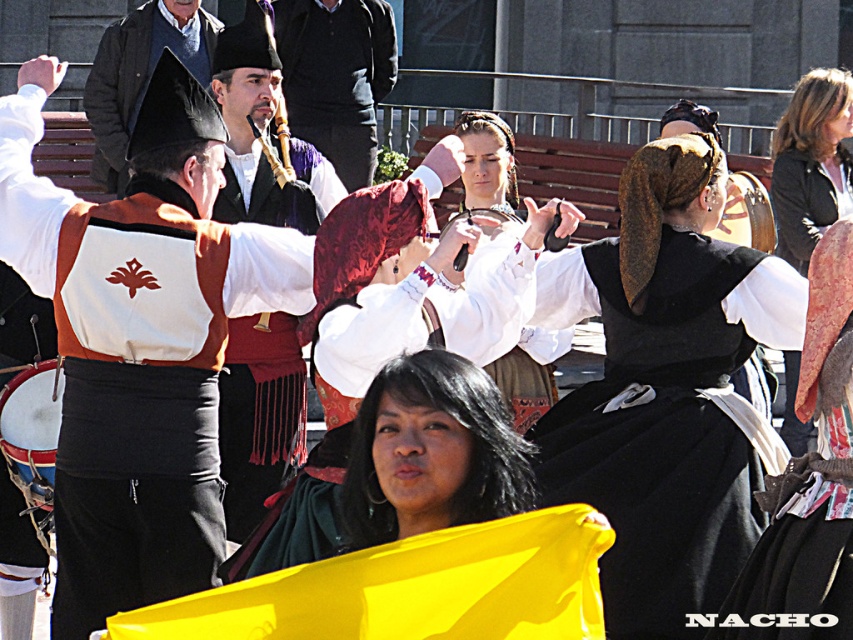
You are a photographer positioned at the center of the scene. You want to capture a photo that includes both the brown leather jacket at upper right and the matte black hat at upper left. Which object should you pan your camera towards first to ensure both are in frame?

You should pan your camera towards the matte black hat at upper left first because the brown leather jacket at upper right is to the right of it, so by starting at the left object, you can adjust the camera to include both in the frame.

You are an event photographer at the cultural festival. You need to capture a photo that clearly shows both the matte black vest at center and the black velvet dress at center. Based on their positions, which one should you focus on first to ensure both are in sharp focus?

The matte black vest at center is above the black velvet dress at center, so you should focus on the matte black vest at center first to ensure both are in sharp focus since it is closer to the camera.

You are standing at the origin point in the image. There are two points marked in the scene. The first point is at coordinates point (664,508) and the second is at point (345,102). Which of these two points is closer to you?

Point (664,508) is in front of point (345,102), so it is closer to you.